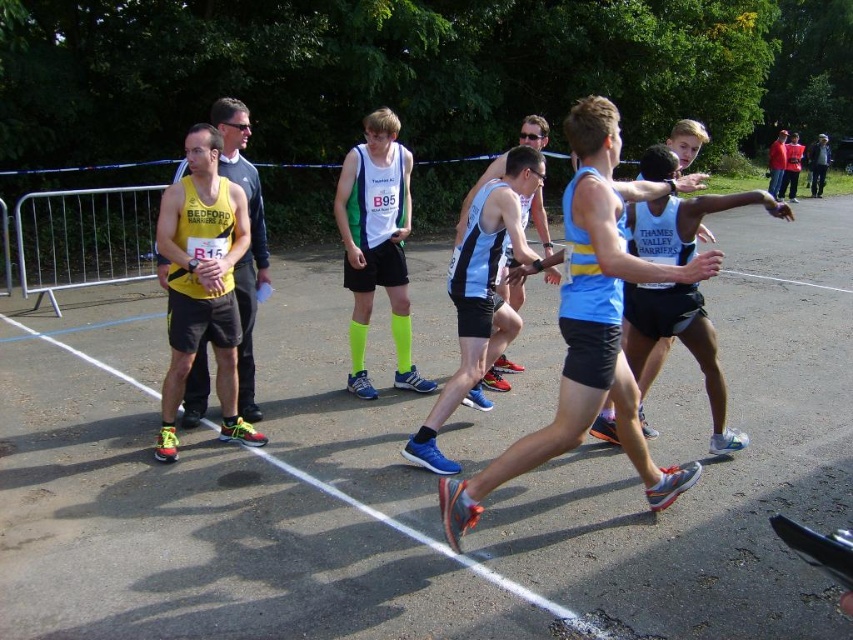
Question: Does yellow matte tank top at left appear over light blue mesh tank top at center?

Choices:
 (A) no
 (B) yes

Answer: (A)

Question: Considering the real-world distances, which object is farthest from the red jacket at upper right?

Choices:
 (A) neon green fabric shorts at center
 (B) yellow matte tank top at left
 (C) light blue mesh tank top at center

Answer: (B)

Question: Is neon green fabric shorts at center to the left of light blue mesh tank top at center from the viewer's perspective?

Choices:
 (A) yes
 (B) no

Answer: (A)

Question: Which object is farther from the camera taking this photo?

Choices:
 (A) light blue mesh tank top at center
 (B) red jacket at upper right
 (C) neon green fabric shorts at center
 (D) yellow matte tank top at left

Answer: (B)

Question: Can you confirm if neon green fabric shorts at center is bigger than light blue mesh tank top at center?

Choices:
 (A) no
 (B) yes

Answer: (A)

Question: Which is nearer to the yellow matte tank top at left?

Choices:
 (A) red jacket at upper right
 (B) neon green fabric shorts at center

Answer: (B)